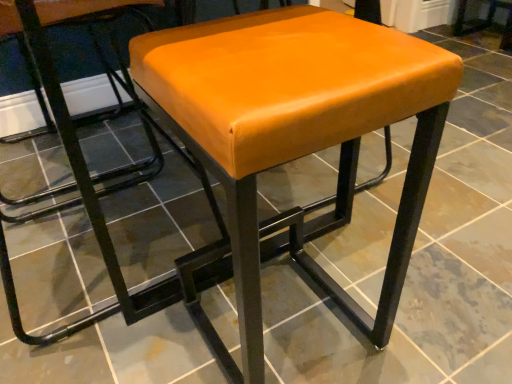
Question: Should I look upward or downward to see orange leather stool at center?

Choices:
 (A) down
 (B) up

Answer: (A)